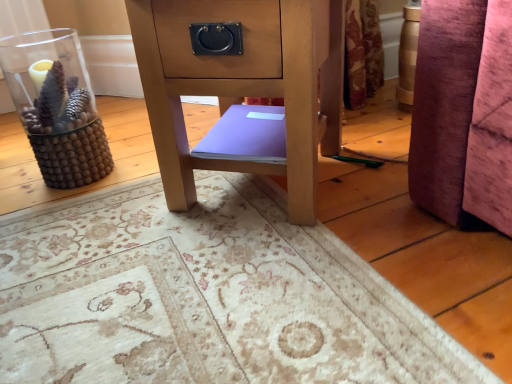
Question: From the image's perspective, is matte wood side table at center positioned above or below purple matte book at center?

Choices:
 (A) above
 (B) below

Answer: (A)

Question: Based on their positions, is matte wood side table at center located to the left or right of purple matte book at center?

Choices:
 (A) right
 (B) left

Answer: (A)

Question: Which of these objects is positioned closest to the matte wood side table at center?

Choices:
 (A) transparent glass vase at left
 (B) purple matte book at center

Answer: (B)

Question: Which object is the closest to the purple matte book at center?

Choices:
 (A) transparent glass vase at left
 (B) matte wood side table at center

Answer: (B)